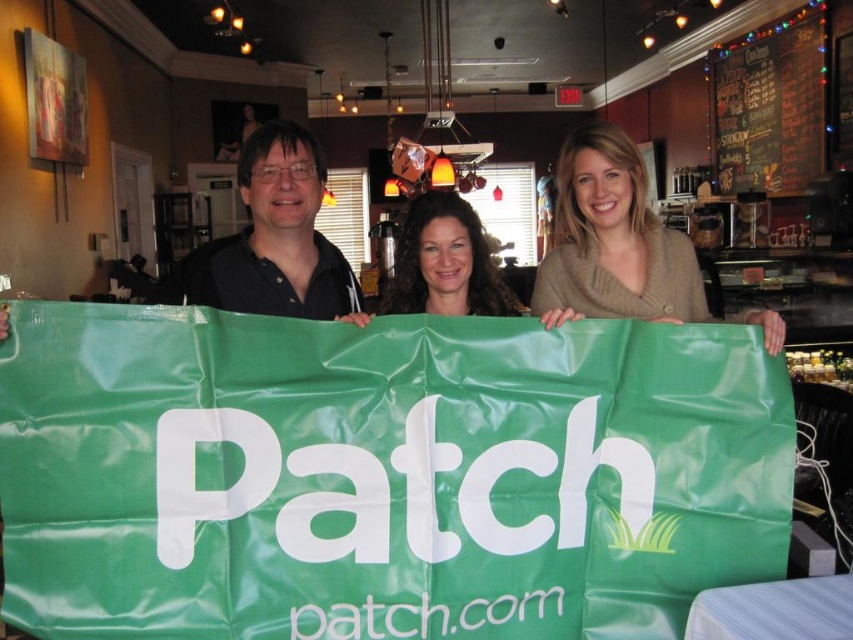
Question: Does black chalkboard menu at upper right appear over curly brown hair at center?

Choices:
 (A) no
 (B) yes

Answer: (B)

Question: Which point is farther to the camera?

Choices:
 (A) black chalkboard menu at upper right
 (B) matte beige sweater at center
 (C) green fabric banner at center

Answer: (A)

Question: Which point appears farthest from the camera in this image?

Choices:
 (A) (577, 244)
 (B) (688, 483)
 (C) (737, 108)

Answer: (C)

Question: Which of the following is the farthest from the observer?

Choices:
 (A) black chalkboard menu at upper right
 (B) green fabric banner at center

Answer: (A)

Question: Can you confirm if matte black shirt at center is smaller than curly brown hair at center?

Choices:
 (A) yes
 (B) no

Answer: (B)

Question: Observing the image, what is the correct spatial positioning of matte beige sweater at center in reference to curly brown hair at center?

Choices:
 (A) left
 (B) right

Answer: (B)